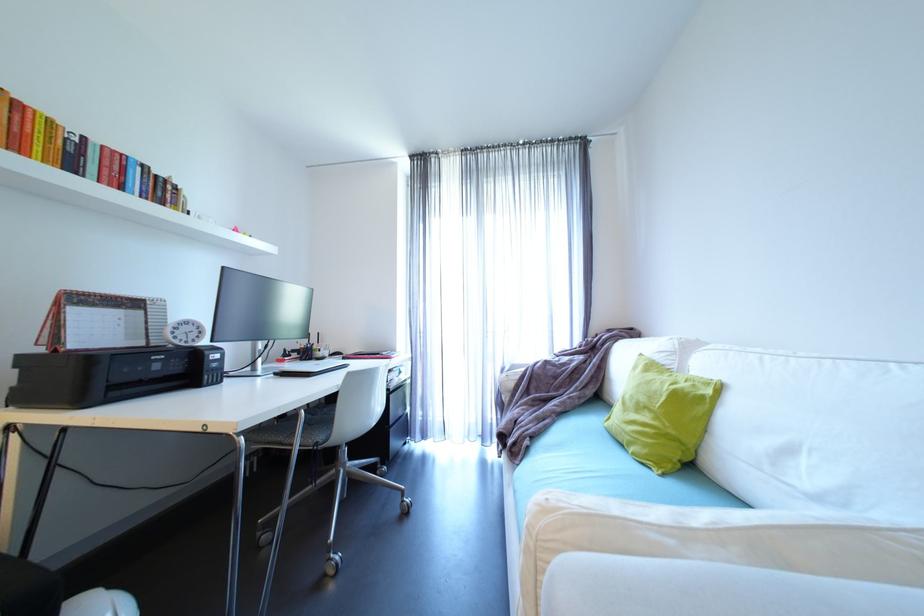
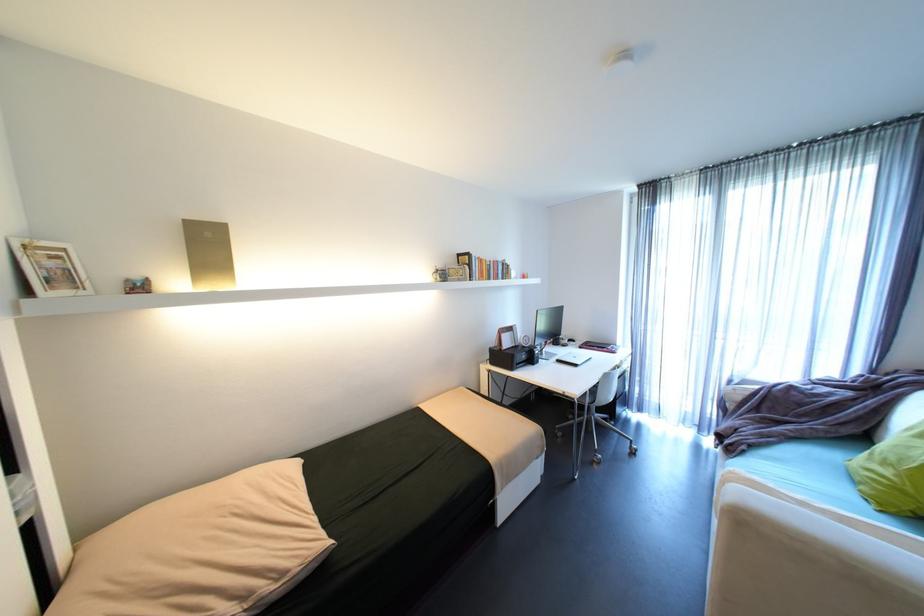
Locate, in the second image, the point that corresponds to point (385, 354) in the first image.

(612, 347)